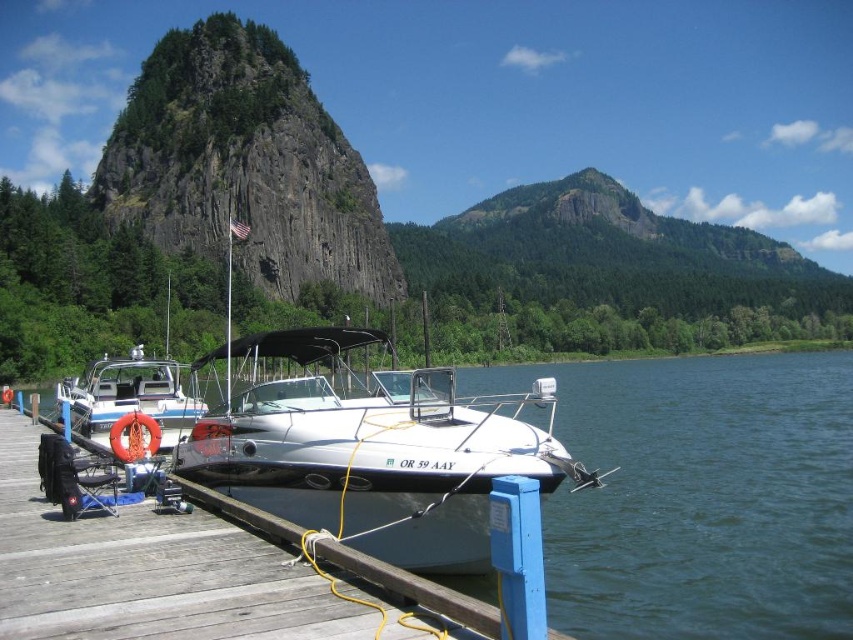
You are standing on the dock and want to move from one point to another. The first point is at coordinates point (547,472) and the second point is at coordinates point (134,376). Which point is closer to you when you are facing the dock?

Point (547,472) is closer to the viewer than point (134,376).

You are standing on the dock and looking out to the water. There is a point marked at coordinates [244,163] in the image. What natural feature is located at that point?

The rugged stone mountain at upper left is located at point [244,163].

You are standing on the wooden dock at lower left and want to take a photo of the rugged stone mountain at upper left. Which direction should you face to capture the mountain in your shot?

You should face to the left side to capture the rugged stone mountain at upper left since it is positioned on the left side of the wooden dock at lower left.